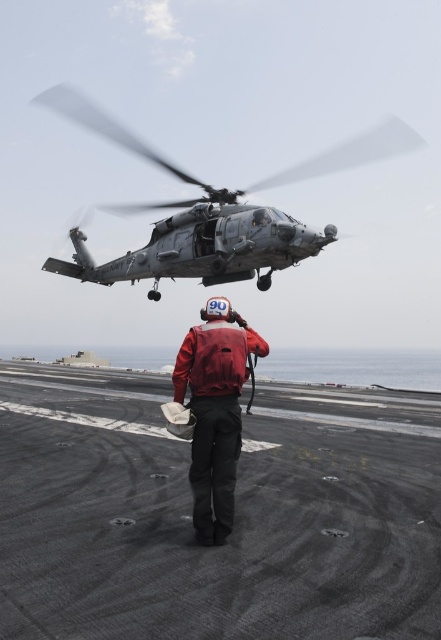
Can you confirm if red fabric jacket at center is positioned to the left of red matte jacket at center?

Incorrect, red fabric jacket at center is not on the left side of red matte jacket at center.

Does red fabric jacket at center have a smaller size compared to red matte jacket at center?

No.

Describe the element at coordinates (215, 412) in the screenshot. I see `red fabric jacket at center` at that location.

Where is `red fabric jacket at center`? red fabric jacket at center is located at coordinates (215, 412).

Between dark gray metallic helicopter at upper center and red matte jacket at center, which one appears on the right side from the viewer's perspective?

From the viewer's perspective, red matte jacket at center appears more on the right side.

The image size is (441, 640). What do you see at coordinates (215, 211) in the screenshot?
I see `dark gray metallic helicopter at upper center` at bounding box center [215, 211].

Where is `dark gray metallic helicopter at upper center`? The height and width of the screenshot is (640, 441). dark gray metallic helicopter at upper center is located at coordinates (215, 211).

Is point (127, 205) farther from camera compared to point (206, 436)?

Yes, point (127, 205) is farther from viewer.

Which is above, dark gray metallic helicopter at upper center or red fabric jacket at center?

dark gray metallic helicopter at upper center is higher up.

The width and height of the screenshot is (441, 640). Describe the element at coordinates (215, 211) in the screenshot. I see `dark gray metallic helicopter at upper center` at that location.

At what (x,y) coordinates should I click in order to perform the action: click on dark gray metallic helicopter at upper center. Please return your answer as a coordinate pair (x, y). The width and height of the screenshot is (441, 640). Looking at the image, I should click on (215, 211).